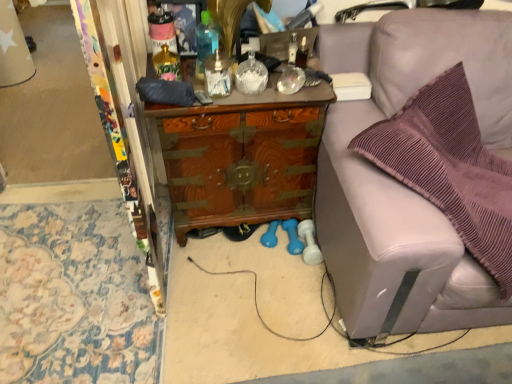
I want to click on free space to the left of clear glass soap dispenser at center, the 2th bottle from the right, so click(x=172, y=90).